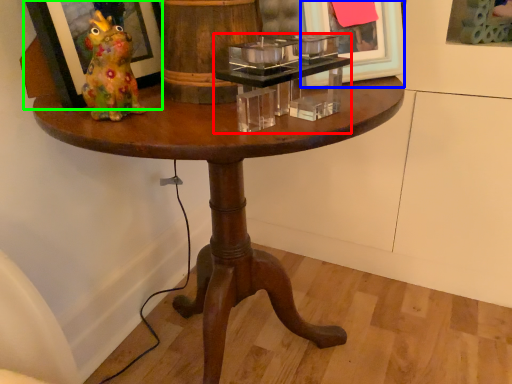
Question: Which is farther away from candle holder (highlighted by a red box)? picture frame (highlighted by a blue box) or picture frame (highlighted by a green box)?

Choices:
 (A) picture frame
 (B) picture frame

Answer: (B)